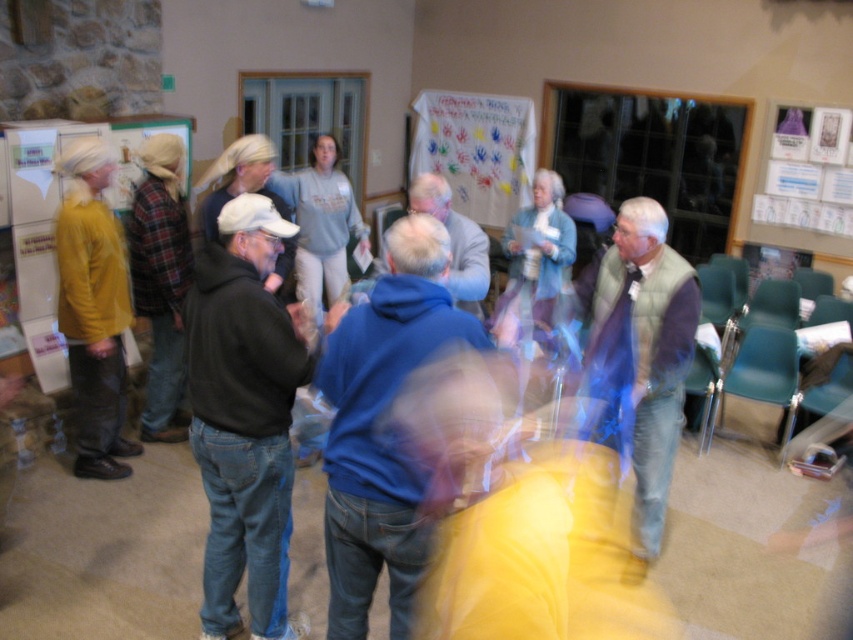
Question: Does light blue vest at center come in front of velvet yellow sweater at left?

Choices:
 (A) yes
 (B) no

Answer: (A)

Question: Is velvet yellow sweater at left positioned before denim jacket at center?

Choices:
 (A) yes
 (B) no

Answer: (A)

Question: Is light blue vest at center to the left of velvet yellow sweater at left from the viewer's perspective?

Choices:
 (A) yes
 (B) no

Answer: (B)

Question: Which of the following is the closest to the observer?

Choices:
 (A) black hoodie at left
 (B) white paperboard at upper right
 (C) velvet yellow sweater at left

Answer: (A)

Question: Which object is positioned farthest from the velvet yellow sweater at left?

Choices:
 (A) light blue vest at center
 (B) blue fleece jacket at center
 (C) denim jacket at center

Answer: (A)

Question: Which point appears farthest from the camera in this image?

Choices:
 (A) pos(230,564)
 (B) pos(128,250)

Answer: (B)